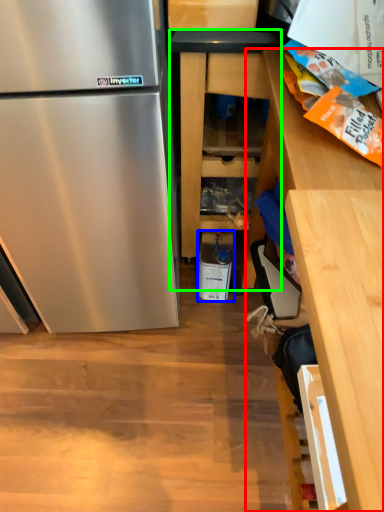
Question: Which is nearer to the cabinetry (highlighted by a red box)? appliance (highlighted by a blue box) or cabinetry (highlighted by a green box).

Choices:
 (A) appliance
 (B) cabinetry

Answer: (B)